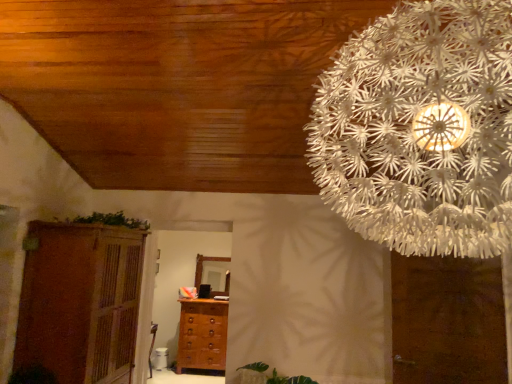
Question: Does point (413, 379) appear closer or farther from the camera than point (86, 221)?

Choices:
 (A) closer
 (B) farther

Answer: (A)

Question: In the image, is brown matte door at upper right positioned in front of or behind green leafy plant at upper left?

Choices:
 (A) front
 (B) behind

Answer: (A)

Question: Considering the real-world distances, which object is closest to the brown wooden cupboard at left?

Choices:
 (A) brown wooden chest of drawers at center
 (B) white paper flower at upper right
 (C) green leafy plant at upper left
 (D) brown matte door at upper right

Answer: (C)

Question: Which object is positioned closest to the green leafy plant at upper left?

Choices:
 (A) brown matte door at upper right
 (B) white paper flower at upper right
 (C) brown wooden chest of drawers at center
 (D) brown wooden cupboard at left

Answer: (D)